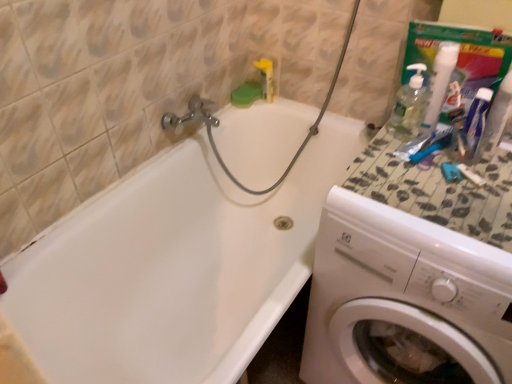
Question: Would you say white plastic washing machine at right contains white pump bottle at upper right, the 1th cleaning product viewed from the right?

Choices:
 (A) yes
 (B) no

Answer: (B)

Question: From a real-world perspective, is white plastic washing machine at right located beneath white pump bottle at upper right, which is counted as the 2th cleaning product, starting from the left?

Choices:
 (A) no
 (B) yes

Answer: (B)

Question: Can you confirm if white plastic washing machine at right is positioned to the right of white pump bottle at upper right, the 1th cleaning product viewed from the right?

Choices:
 (A) no
 (B) yes

Answer: (B)

Question: Does white plastic washing machine at right have a greater width compared to white pump bottle at upper right, which is counted as the 2th cleaning product, starting from the left?

Choices:
 (A) yes
 (B) no

Answer: (A)

Question: Would you consider white plastic washing machine at right to be distant from white pump bottle at upper right, which is counted as the 2th cleaning product, starting from the left?

Choices:
 (A) no
 (B) yes

Answer: (A)

Question: Is speckled stone countertop at right situated inside yellow plastic toothbrush at upper center or outside?

Choices:
 (A) inside
 (B) outside

Answer: (B)

Question: In the image, is speckled stone countertop at right on the left side or the right side of yellow plastic toothbrush at upper center?

Choices:
 (A) right
 (B) left

Answer: (A)

Question: Considering the positions of speckled stone countertop at right and yellow plastic toothbrush at upper center in the image, is speckled stone countertop at right taller or shorter than yellow plastic toothbrush at upper center?

Choices:
 (A) short
 (B) tall

Answer: (A)

Question: From a real-world perspective, is speckled stone countertop at right above or below yellow plastic toothbrush at upper center?

Choices:
 (A) above
 (B) below

Answer: (A)

Question: Is speckled stone countertop at right bigger or smaller than white plastic toothpaste at upper right?

Choices:
 (A) big
 (B) small

Answer: (A)

Question: Is speckled stone countertop at right to the left or to the right of white plastic toothpaste at upper right in the image?

Choices:
 (A) right
 (B) left

Answer: (B)

Question: In the image, is speckled stone countertop at right positioned in front of or behind white plastic toothpaste at upper right?

Choices:
 (A) front
 (B) behind

Answer: (A)

Question: Is speckled stone countertop at right inside or outside of white plastic toothpaste at upper right?

Choices:
 (A) outside
 (B) inside

Answer: (A)

Question: In terms of size, does white glossy bathtub at upper left appear bigger or smaller than white plastic washing machine at right?

Choices:
 (A) big
 (B) small

Answer: (A)

Question: In terms of width, does white glossy bathtub at upper left look wider or thinner when compared to white plastic washing machine at right?

Choices:
 (A) wide
 (B) thin

Answer: (A)